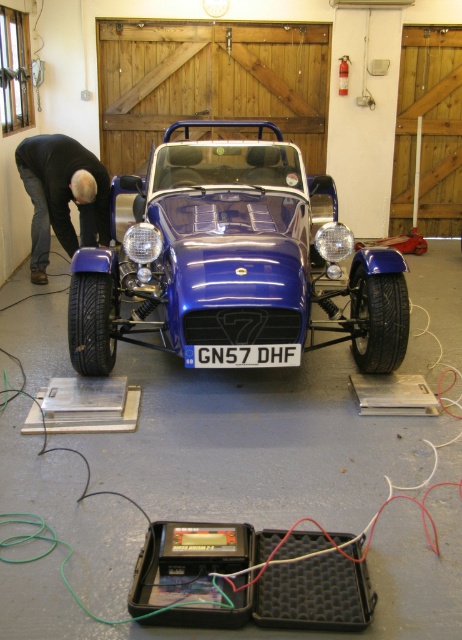
Between glossy blue car at center and dark blue jeans at left, which one appears on the right side from the viewer's perspective?

glossy blue car at center

Between point (133, 276) and point (48, 195), which one is positioned behind?

Positioned behind is point (48, 195).

Locate an element on the screen. This screenshot has width=462, height=640. glossy blue car at center is located at coordinates (233, 259).

Based on the photo, can you confirm if glossy blue car at center is bigger than black plastic license plate at center?

Yes, glossy blue car at center is bigger than black plastic license plate at center.

Which is behind, point (111, 269) or point (242, 346)?

The point (111, 269) is more distant.

What are the coordinates of `glossy blue car at center` in the screenshot? It's located at (233, 259).

Can you confirm if dark blue jeans at left is positioned below black plastic license plate at center?

No, dark blue jeans at left is not below black plastic license plate at center.

Is point (35, 262) farther from viewer compared to point (277, 353)?

Yes, it is behind point (277, 353).

Locate an element on the screen. The image size is (462, 640). dark blue jeans at left is located at coordinates (62, 195).